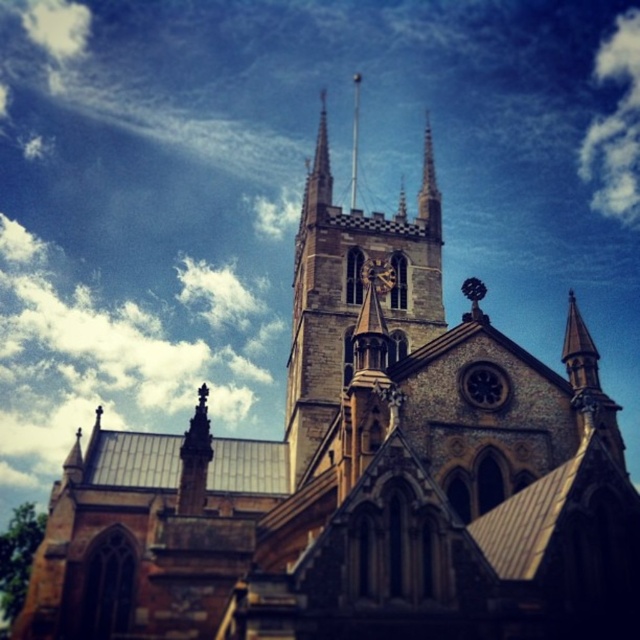
You are an architect analyzing the church facade. You notice the dark gray stone clock at upper center and the stone spire at upper center. Which of these two objects is larger in size?

The stone spire at upper center is larger than the dark gray stone clock at upper center.

You are standing in front of the grand Gothic church and want to take a photo that includes both the brown stone clock tower at center and the stone spire at upper center. Which one of these two objects will appear taller in your photo?

The brown stone clock tower at center will appear taller in the photo because it is much taller than the stone spire at upper center according to the description.

You are standing in front of the Gothic church and notice two spires. The smooth stone spire at center and the stone spire at upper center. Which spire is closer to you?

The smooth stone spire at center is closer to you since it is in front of the stone spire at upper center.